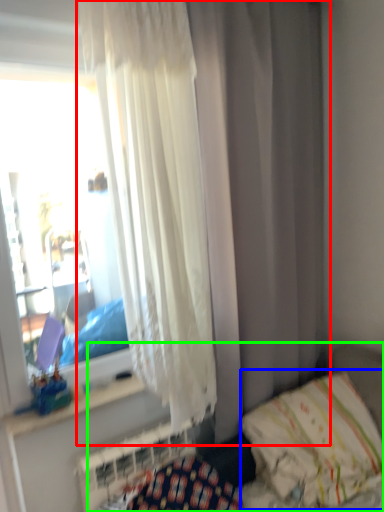
Question: Which is nearer to the curtain (highlighted by a red box)? pillow (highlighted by a blue box) or hospital bed (highlighted by a green box).

Choices:
 (A) pillow
 (B) hospital bed

Answer: (A)